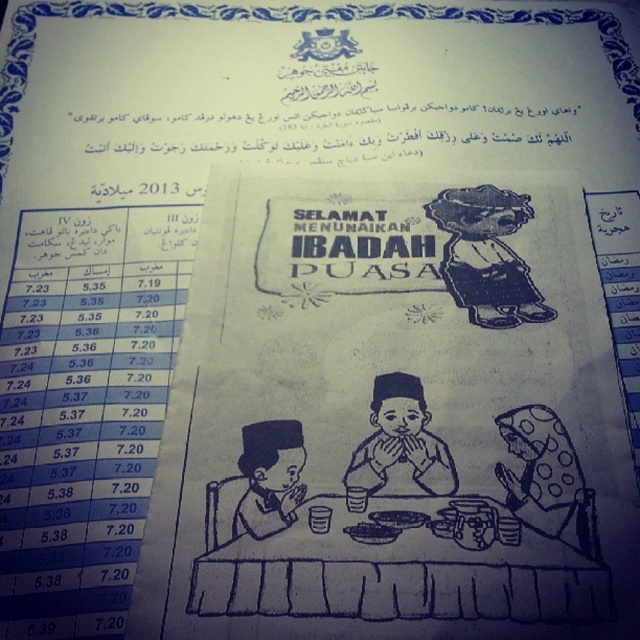
Question: Can you confirm if black paper doll at upper right is bigger than black ink drawing of child at center?

Choices:
 (A) yes
 (B) no

Answer: (A)

Question: Which of the following is the closest to the observer?

Choices:
 (A) (348, 593)
 (B) (428, 518)
 (C) (276, 506)

Answer: (A)

Question: Is the position of polka dot fabric headscarf at lower right more distant than that of black ink drawing of child at center?

Choices:
 (A) no
 (B) yes

Answer: (A)

Question: Among these points, which one is farthest from the camera?

Choices:
 (A) (557, 516)
 (B) (573, 588)
 (C) (252, 497)

Answer: (C)

Question: Is black paper doll at upper right thinner than dark brown matte plate at center?

Choices:
 (A) no
 (B) yes

Answer: (A)

Question: Which object is farther from the camera taking this photo?

Choices:
 (A) black paper table at center
 (B) black ink drawing of child at center
 (C) black paper doll at upper right

Answer: (C)